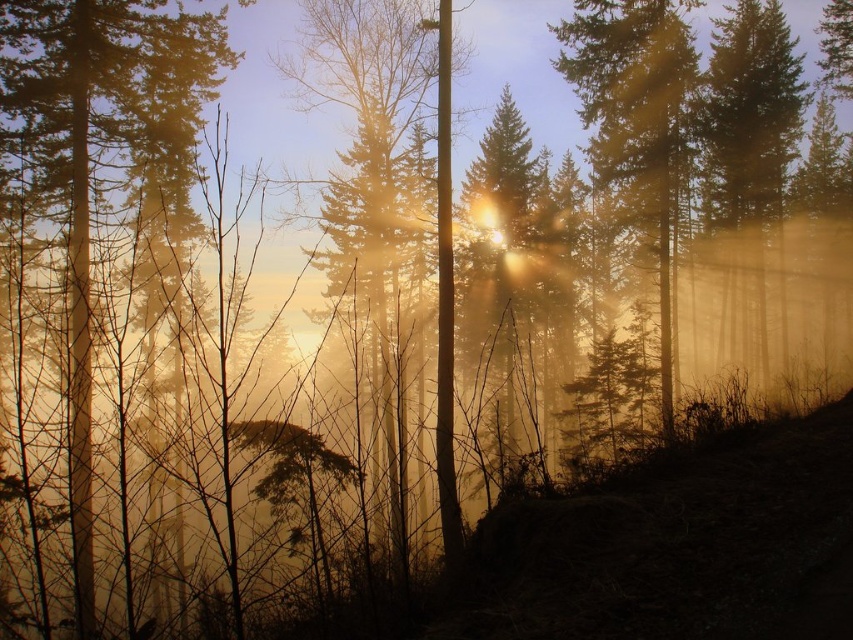
You are an artist trying to paint the forest scene. You want to ensure the silvery metallic tree at center and the smooth brown tree trunk at left are proportionally accurate. Which tree should you paint as shorter?

The silvery metallic tree at center should be painted as shorter than the smooth brown tree trunk at left because the silvery metallic tree at center is not as tall as smooth brown tree trunk at left.

You are an artist trying to paint the forest scene. You want to ensure the silvery metallic tree at center and the smooth brown tree trunk at left are proportionally accurate. Which tree should you paint as narrower?

The silvery metallic tree at center should be painted as narrower since its width is less than the smooth brown tree trunk at left.

From the picture: You are a hiker standing in the middle of the forest. You see the smooth brown tree trunk at left and the smooth golden tree at right. Which tree is positioned higher in the image?

The smooth brown tree trunk at left is positioned higher in the image than the smooth golden tree at right.